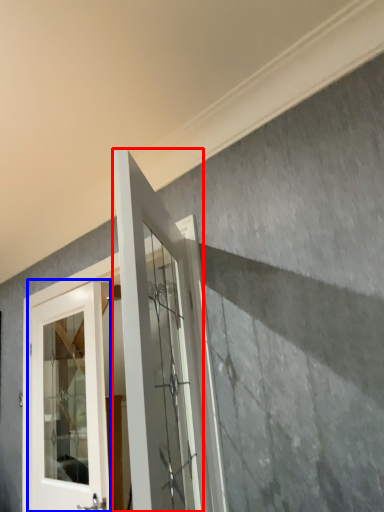
Question: Which object is closer to the camera taking this photo, door (highlighted by a red box) or door (highlighted by a blue box)?

Choices:
 (A) door
 (B) door

Answer: (A)